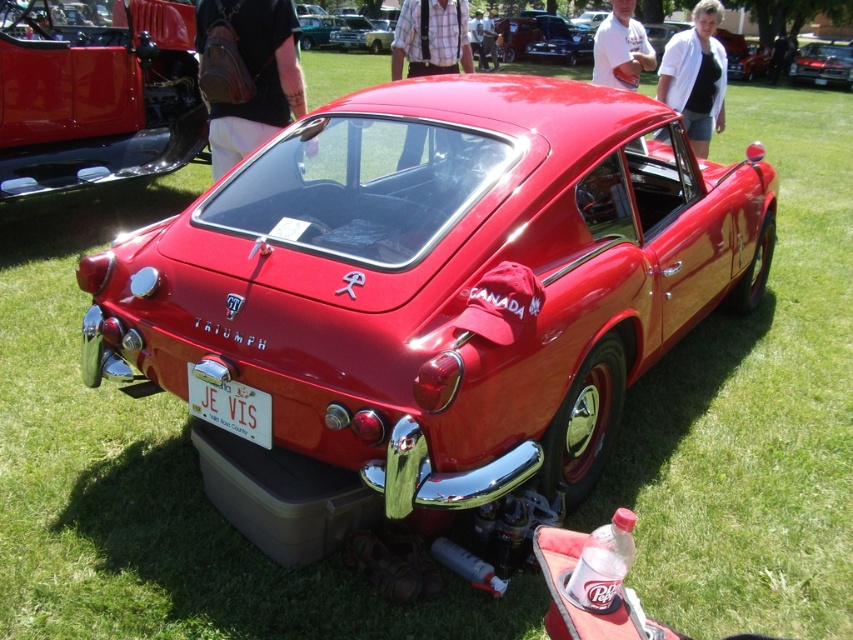
How much distance is there between white plastic license plate at center and shiny metallic car at center?

white plastic license plate at center is 26.12 meters away from shiny metallic car at center.

Between point (202, 384) and point (550, 52), which one is positioned in front?

Point (202, 384) is more forward.

Identify the location of white plastic license plate at center. (231, 406).

Is white plastic license plate at center smaller than glossy red car at center?

Correct, white plastic license plate at center occupies less space than glossy red car at center.

Is point (233, 426) positioned before point (302, 24)?

Yes, point (233, 426) is closer to viewer.

This screenshot has height=640, width=853. I want to click on white plastic license plate at center, so click(x=231, y=406).

Does shiny metallic car at center have a smaller size compared to glossy red car at center?

Correct, shiny metallic car at center occupies less space than glossy red car at center.

Between point (535, 45) and point (334, 28), which one is positioned behind?

Positioned behind is point (334, 28).

Locate an element on the screen. shiny metallic car at center is located at coordinates (543, 36).